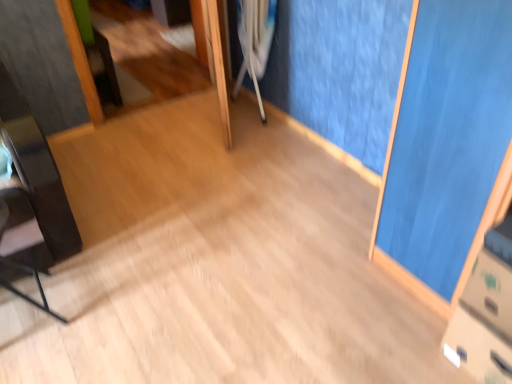
Locate an element on the screen. The image size is (512, 384). free space on the front side of white plastic crutch at center is located at coordinates (264, 128).